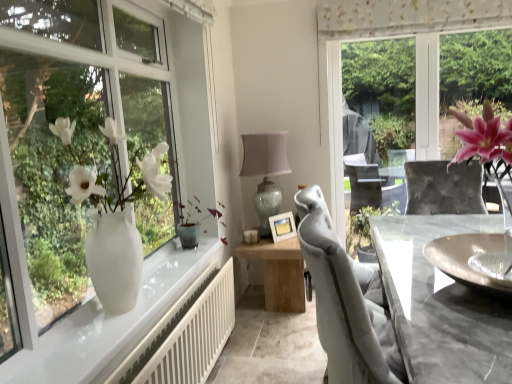
Measure the distance between point (430,0) and camera.

The depth of point (430,0) is 9.42 feet.

Image resolution: width=512 pixels, height=384 pixels. In order to click on sheer floral-patterned curtain at upper center in this screenshot , I will do (408, 17).

What do you see at coordinates (185, 334) in the screenshot? I see `white matte radiator at lower left` at bounding box center [185, 334].

Image resolution: width=512 pixels, height=384 pixels. Find the location of `sheer floral-patterned curtain at upper center`. sheer floral-patterned curtain at upper center is located at coordinates (408, 17).

Locate an element on the screen. The width and height of the screenshot is (512, 384). plant above the white matte radiator at lower left (from the image's perspective) is located at coordinates (194, 221).

How many degrees apart are the facing directions of white matte radiator at lower left and green matte plant at center?

white matte radiator at lower left and green matte plant at center are facing 0.433 degrees away from each other.

Is white matte radiator at lower left oriented away from green matte plant at center?

No.

Based on the photo, from the image's perspective, between white matte radiator at lower left and green matte plant at center, who is located below?

white matte radiator at lower left is shown below in the image.

From a real-world perspective, who is located lower, white glossy vase at left or matte glass table lamp at center?

matte glass table lamp at center.

From their relative heights in the image, would you say white glossy vase at left is taller or shorter than matte glass table lamp at center?

white glossy vase at left is taller than matte glass table lamp at center.

Does white glossy vase at left have a lesser width compared to matte glass table lamp at center?

Correct, the width of white glossy vase at left is less than that of matte glass table lamp at center.

Is white glossy vase at left oriented towards matte glass table lamp at center?

No, white glossy vase at left is not aimed at matte glass table lamp at center.

In terms of height, does matte glass table lamp at center look taller or shorter compared to green matte plant at center?

In the image, matte glass table lamp at center appears to be taller than green matte plant at center.

From the picture: Is matte glass table lamp at center wider or thinner than green matte plant at center?

matte glass table lamp at center is wider than green matte plant at center.

From a real-world perspective, is pink flower vase at right above or below green matte plant at center?

Clearly, from a real-world perspective, pink flower vase at right is above green matte plant at center.

Is pink flower vase at right facing towards green matte plant at center?

No, pink flower vase at right is not turned towards green matte plant at center.

Locate an element on the screen. window screen above the green matte plant at center (from the image's perspective) is located at coordinates (397, 36).

Is pink flower vase at right placed right next to green matte plant at center?

No, pink flower vase at right is not with green matte plant at center.

Which is in front, point (338, 221) or point (392, 0)?

Point (392, 0)

From the image's perspective, between pink flower vase at right and sheer floral-patterned curtain at upper center, who is located below?

pink flower vase at right, from the image's perspective.

At what (x,y) coordinates should I click in order to perform the action: click on curtain on the left of pink flower vase at right. Please return your answer as a coordinate pair (x, y). The image size is (512, 384). Looking at the image, I should click on (408, 17).

From a real-world perspective, is pink flower vase at right physically located above or below sheer floral-patterned curtain at upper center?

Clearly, from a real-world perspective, pink flower vase at right is below sheer floral-patterned curtain at upper center.

Considering the relative positions of wooden table at center and green matte plant at center in the image provided, is wooden table at center behind green matte plant at center?

Yes.

From the image's perspective, relative to green matte plant at center, is wooden table at center above or below?

wooden table at center is situated lower than green matte plant at center in the image.

In terms of width, does wooden table at center look wider or thinner when compared to green matte plant at center?

wooden table at center is wider than green matte plant at center.

Which is more to the right, wooden table at center or green matte plant at center?

wooden table at center is more to the right.

From a real-world perspective, is white matte radiator at lower left positioned over pink flower vase at right based on gravity?

No, from a real-world perspective, white matte radiator at lower left is not above pink flower vase at right.

Does white matte radiator at lower left turn towards pink flower vase at right?

No, white matte radiator at lower left is not turned towards pink flower vase at right.

Which object is more forward, white matte radiator at lower left or pink flower vase at right?

white matte radiator at lower left.

At what (x,y) coordinates should I click in order to perform the action: click on radiator that is in front of the green matte plant at center. Please return your answer as a coordinate pair (x, y). The image size is (512, 384). Looking at the image, I should click on (185, 334).

Locate an element on the screen. This screenshot has height=384, width=512. floral arrangement that appears on the left of matte glass table lamp at center is located at coordinates (113, 215).

Considering their positions, is white glossy vase at left positioned further to green matte plant at center than white matte radiator at lower left?

white glossy vase at left.

Considering their positions, is pink flower vase at right positioned closer to matte glass table lamp at center than wooden table at center?

Based on the image, wooden table at center appears to be nearer to matte glass table lamp at center.

Looking at the image, which one is located closer to white matte radiator at lower left, wooden table at center or white glossy vase at left?

Among the two, white glossy vase at left is located nearer to white matte radiator at lower left.

Estimate the real-world distances between objects in this image. Which object is further from wooden table at center, white matte radiator at lower left or matte glass table lamp at center?

white matte radiator at lower left lies further to wooden table at center than the other object.

From the image, which object appears to be nearer to white glossy vase at left, sheer floral-patterned curtain at upper center or pink flower vase at right?

pink flower vase at right.

From the picture: When comparing their distances from white matte radiator at lower left, does white glossy vase at left or green matte plant at center seem closer?

Based on the image, white glossy vase at left appears to be nearer to white matte radiator at lower left.

Considering their positions, is white glossy vase at left positioned closer to white matte radiator at lower left than pink flower vase at right?

Based on the image, white glossy vase at left appears to be nearer to white matte radiator at lower left.

Estimate the real-world distances between objects in this image. Which object is further from sheer floral-patterned curtain at upper center, white matte radiator at lower left or pink flower vase at right?

Among the two, white matte radiator at lower left is located further to sheer floral-patterned curtain at upper center.

At what (x,y) coordinates should I click in order to perform the action: click on plant between matte glass table lamp at center and wooden table at center from top to bottom. Please return your answer as a coordinate pair (x, y). This screenshot has width=512, height=384. Looking at the image, I should click on (194, 221).

This screenshot has width=512, height=384. In order to click on plant between white glossy vase at left and pink flower vase at right from left to right in this screenshot , I will do `click(194, 221)`.

This screenshot has width=512, height=384. What are the coordinates of `floral arrangement between white matte radiator at lower left and wooden table at center from front to back` in the screenshot? It's located at (113, 215).

Locate an element on the screen. This screenshot has height=384, width=512. table lamp between green matte plant at center and pink flower vase at right is located at coordinates (265, 172).